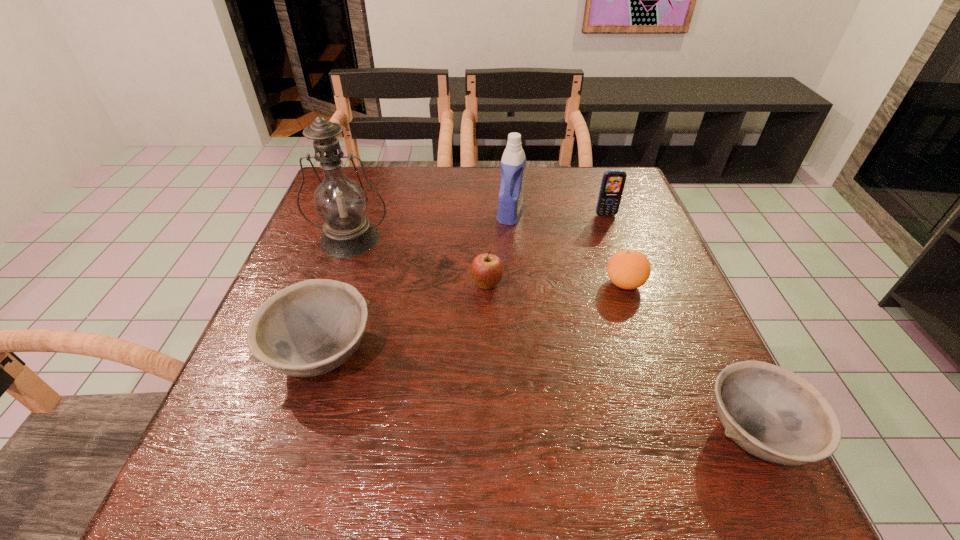
Where is `free space located 0.130m on the right of the sixth shortest object`? The height and width of the screenshot is (540, 960). free space located 0.130m on the right of the sixth shortest object is located at coordinates (572, 214).

At what (x,y) coordinates should I click in order to perform the action: click on free space located 0.320m on the screen of the cellular telephone. Please return your answer as a coordinate pair (x, y). The image size is (960, 540). Looking at the image, I should click on [x=637, y=304].

Where is `vacant region located on the left of the orange`? vacant region located on the left of the orange is located at coordinates (502, 284).

Find the location of a particular element. free space located 0.260m on the right of the apple is located at coordinates (618, 285).

Image resolution: width=960 pixels, height=540 pixels. I want to click on object that is at the far edge, so click(x=513, y=163).

At what (x,y) coordinates should I click in order to perform the action: click on bowl positioned at the left edge. Please return your answer as a coordinate pair (x, y). This screenshot has width=960, height=540. Looking at the image, I should click on (310, 328).

The width and height of the screenshot is (960, 540). What are the coordinates of `oil lamp that is at the left edge` in the screenshot? It's located at (340, 202).

Locate an element on the screen. The image size is (960, 540). bowl that is at the right edge is located at coordinates (772, 413).

You are a GUI agent. You are given a task and a screenshot of the screen. Output one action in this format:
    pyautogui.click(x=<x>, y=<y>)
    Task: Click on the cellular telephone located at the right edge
    
    Given the screenshot: What is the action you would take?
    [613, 181]

The height and width of the screenshot is (540, 960). In order to click on orange that is at the right edge in this screenshot , I will do `click(628, 269)`.